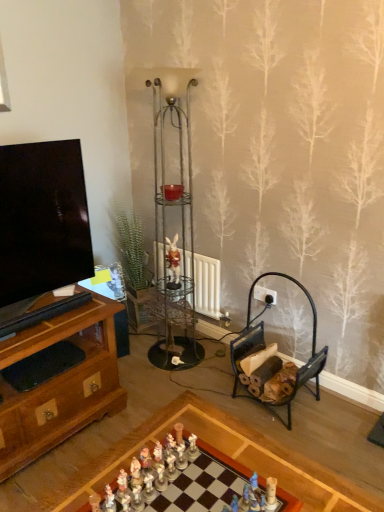
This screenshot has width=384, height=512. Identify the location of vacant space to the left of white porcelain figurines at center, positioned as the second toy in right-to-left order. (112, 468).